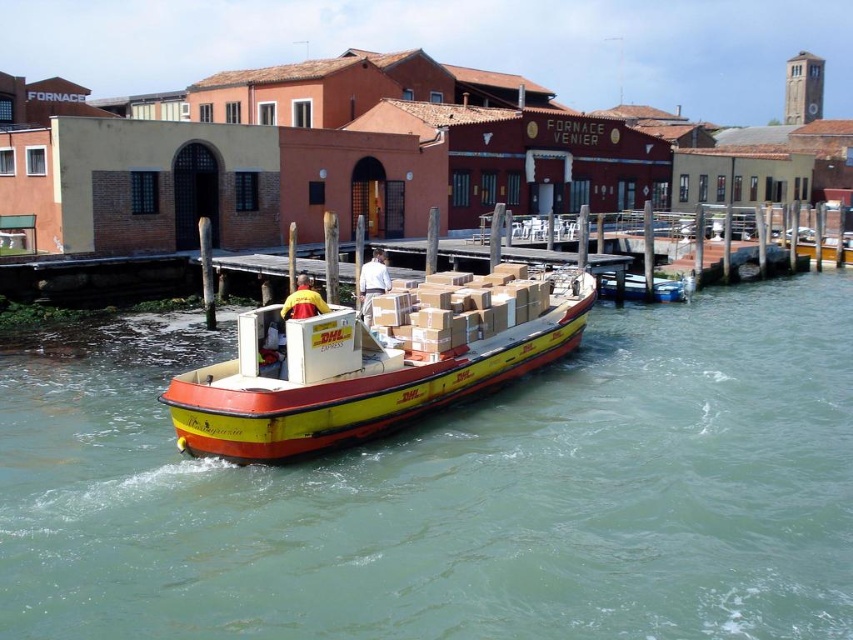
Who is shorter, green water at center or brown cardboard boxes at center?

With less height is brown cardboard boxes at center.

Can you confirm if green water at center is taller than brown cardboard boxes at center?

Yes, green water at center is taller than brown cardboard boxes at center.

Which is in front, point (585, 557) or point (526, 288)?

Point (585, 557) is in front.

You are a GUI agent. You are given a task and a screenshot of the screen. Output one action in this format:
    pyautogui.click(x=<x>, y=<y>)
    Task: Click on the green water at center
    Image resolution: width=853 pixels, height=640 pixels.
    Given the screenshot: What is the action you would take?
    pyautogui.click(x=456, y=492)

Does yellow matte boat at center lie behind brown cardboard boxes at center?

No, yellow matte boat at center is closer to the viewer.

This screenshot has height=640, width=853. Describe the element at coordinates (374, 364) in the screenshot. I see `yellow matte boat at center` at that location.

What do you see at coordinates (374, 364) in the screenshot? The width and height of the screenshot is (853, 640). I see `yellow matte boat at center` at bounding box center [374, 364].

You are a GUI agent. You are given a task and a screenshot of the screen. Output one action in this format:
    pyautogui.click(x=<x>, y=<y>)
    Task: Click on the yellow matte boat at center
    The width and height of the screenshot is (853, 640).
    Given the screenshot: What is the action you would take?
    pyautogui.click(x=374, y=364)

Does green water at center lie behind yellow matte boat at center?

No.

Which is above, green water at center or yellow matte boat at center?

yellow matte boat at center is higher up.

What do you see at coordinates (456, 492) in the screenshot?
I see `green water at center` at bounding box center [456, 492].

Find the location of `green water at center`. green water at center is located at coordinates (456, 492).